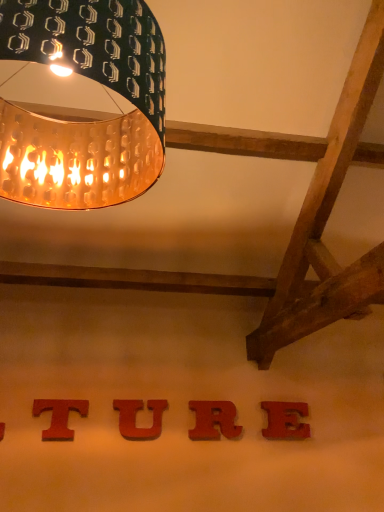
Question: From the image's perspective, relative to red wood u at center, placed as the 3th alphabet when sorted from right to left, is red matte letter r at center, which is counted as the second alphabet, starting from the right, above or below?

Choices:
 (A) below
 (B) above

Answer: (A)

Question: Considering their positions, is red matte letter r at center, which is counted as the second alphabet, starting from the right, located in front of or behind red wood u at center, the second alphabet in the left-to-right sequence?

Choices:
 (A) behind
 (B) front

Answer: (A)

Question: Which object is the farthest from the red wood letter t at lower center, placed as the 1th alphabet when sorted from left to right?

Choices:
 (A) red matte letter e at center, the 4th alphabet viewed from the left
 (B) red matte letter r at center, which ranks as the third alphabet in left-to-right order
 (C) red wood u at center, the second alphabet in the left-to-right sequence
 (D) gold perforated lampshade at upper left

Answer: (D)

Question: Estimate the real-world distances between objects in this image. Which object is farther from the red matte letter e at center, the 4th alphabet viewed from the left?

Choices:
 (A) red wood u at center, the second alphabet in the left-to-right sequence
 (B) red matte letter r at center, which is counted as the second alphabet, starting from the right
 (C) gold perforated lampshade at upper left
 (D) red wood letter t at lower center, placed as the 1th alphabet when sorted from left to right

Answer: (C)